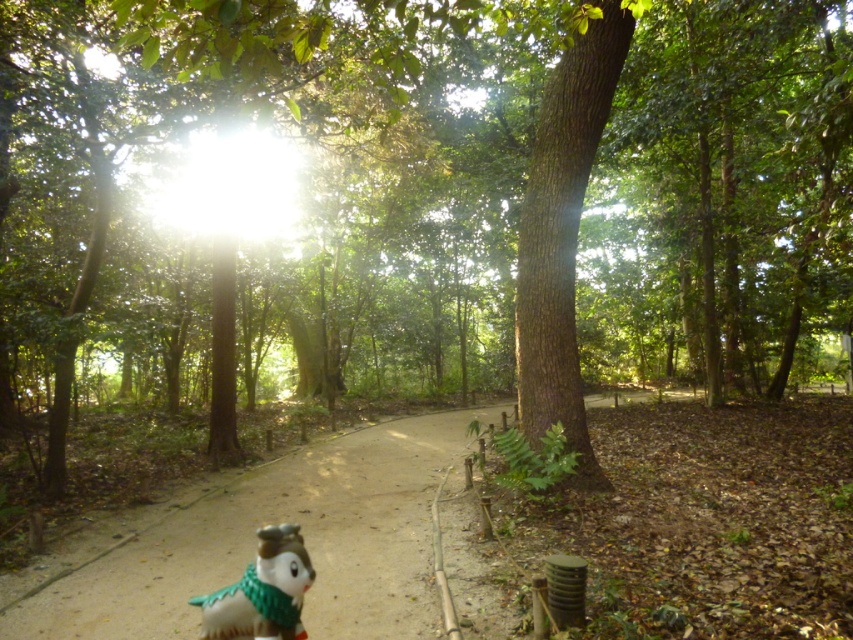
Which is above, sandy dirt path at center or porcelain figurine at lower center?

Positioned higher is porcelain figurine at lower center.

Between point (334, 625) and point (283, 604), which one is positioned behind?

The point (334, 625) is more distant.

Identify the location of sandy dirt path at center. The width and height of the screenshot is (853, 640). (305, 538).